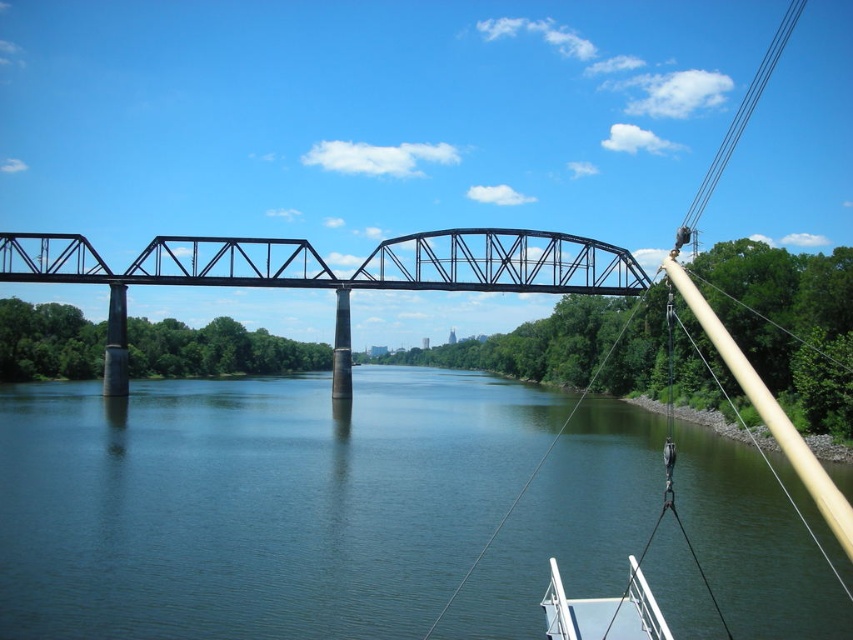
You are a photographer standing on the black truss bridge at center. You want to take a photo that includes both the green smooth water at center and the white glossy boat at lower right. Which object will appear larger in your photo?

The green smooth water at center will appear larger in the photo because it is much taller than the white glossy boat at lower right.

You are a bird flying above the river and want to land on the green smooth water at center. Is the black metal train bridge at center blocking your path to the water?

The green smooth water at center is located below the black metal train bridge at center, so the bridge is blocking the path to the water.